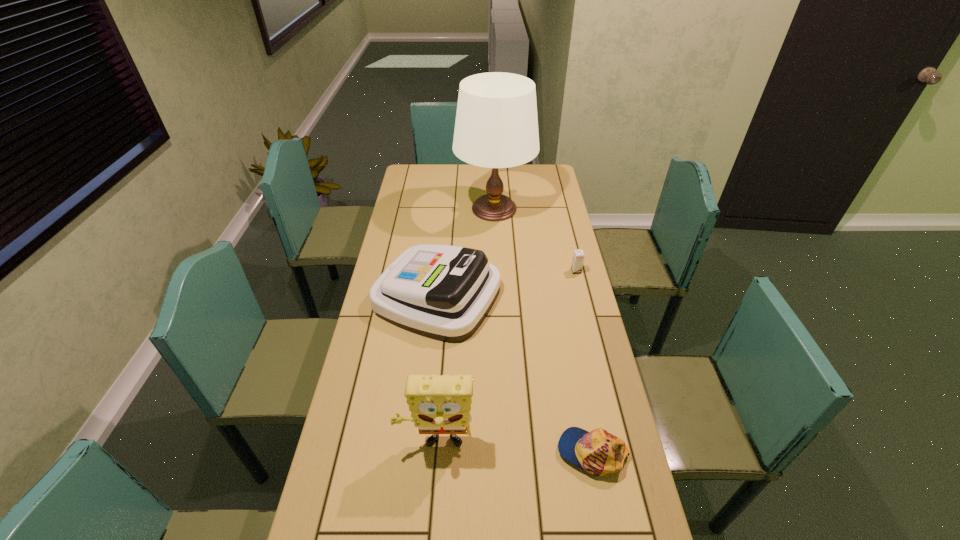
Image resolution: width=960 pixels, height=540 pixels. Identify the location of free space that satisfies the following two spatial constraints: 1. on the front side of the chocolate milk; 2. on the bill of the cap. (620, 452).

Locate an element on the screen. Image resolution: width=960 pixels, height=540 pixels. free region that satisfies the following two spatial constraints: 1. on the back side of the chocolate milk; 2. on the left side of the third tallest object is located at coordinates (440, 272).